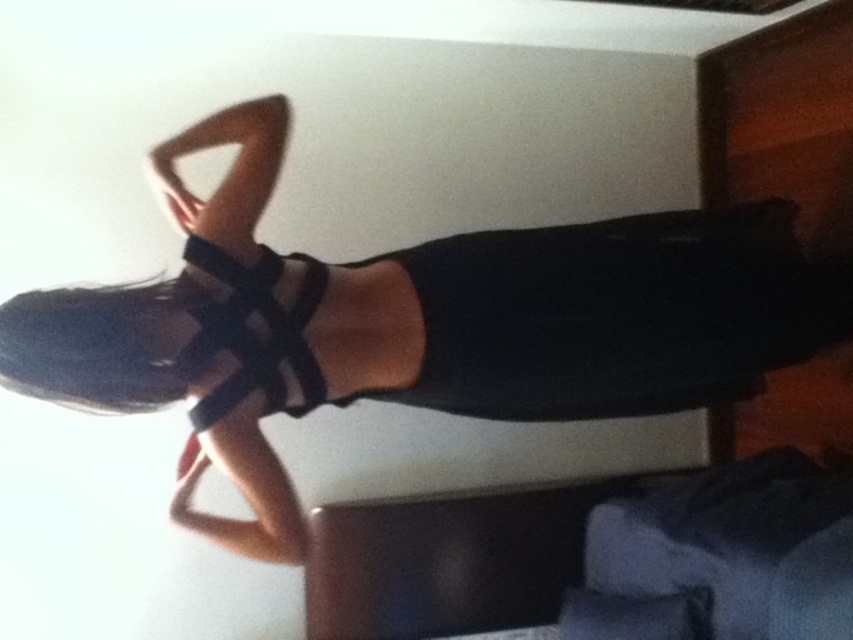
Which is above, matte black dress at center or black mesh strap at center?

matte black dress at center

Is matte black dress at center below black mesh strap at center?

No, matte black dress at center is not below black mesh strap at center.

Is point (199, 280) farther from viewer compared to point (328, 278)?

That is False.

Locate an element on the screen. matte black dress at center is located at coordinates [415, 324].